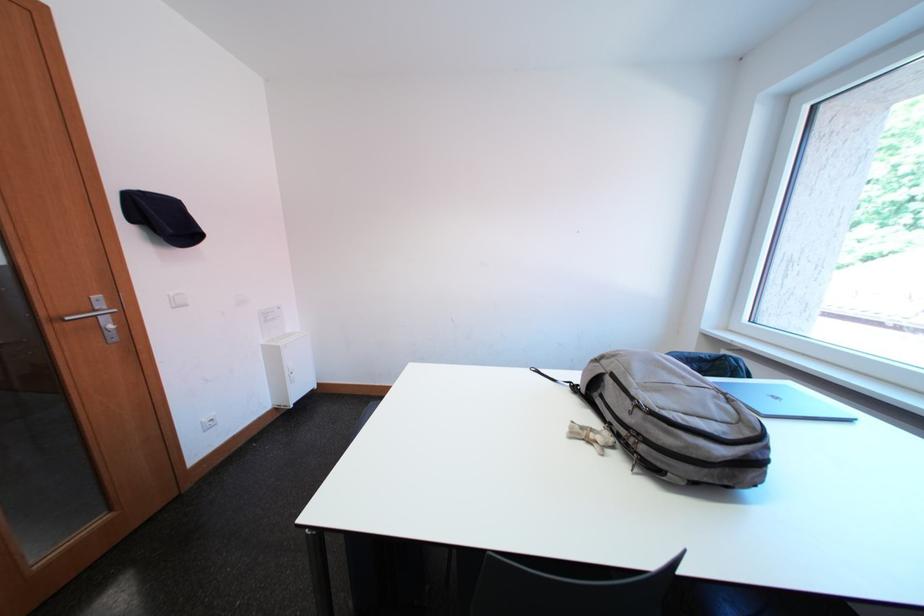
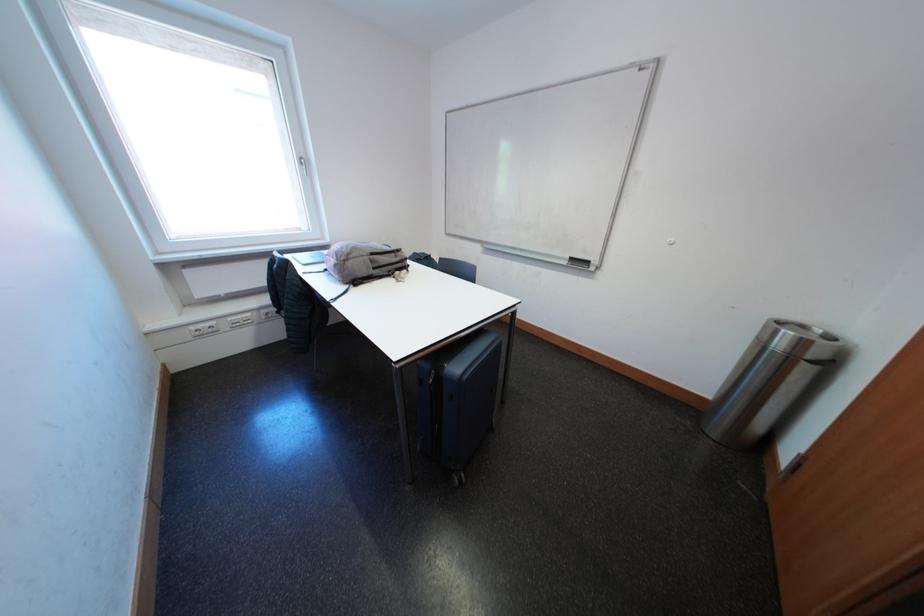
The point at (640, 416) is marked in the first image. Where is the corresponding point in the second image?

(406, 261)